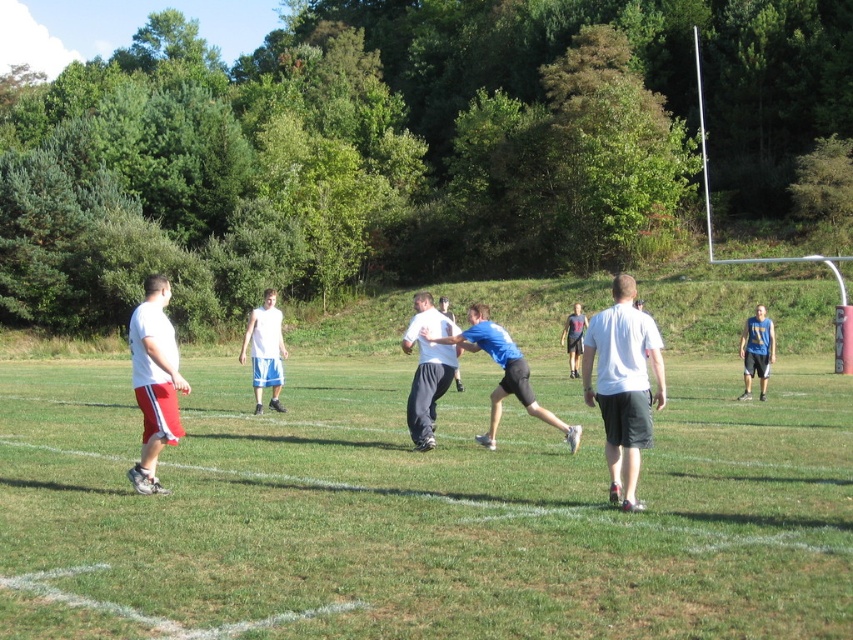
Question: Is matte white shorts at left positioned at the back of blue fabric shirt at center?

Choices:
 (A) yes
 (B) no

Answer: (B)

Question: Is green grass football field at center to the right of blue fabric shirt at center from the viewer's perspective?

Choices:
 (A) no
 (B) yes

Answer: (A)

Question: Which point is farther from the camera taking this photo?

Choices:
 (A) (437, 348)
 (B) (258, 320)
 (C) (144, 541)

Answer: (B)

Question: Is matte white shorts at left wider than blue t-shirt at right?

Choices:
 (A) yes
 (B) no

Answer: (A)

Question: Which is farther from the green grass football field at center?

Choices:
 (A) blue t-shirt at center
 (B) blue fabric shirt at center
 (C) matte white shirt at center
 (D) white matte t-shirt at center

Answer: (A)

Question: Which of these objects is positioned farthest from the matte white shorts at left?

Choices:
 (A) green grass football field at center
 (B) matte white shirt at center
 (C) white matte t-shirt at center

Answer: (A)